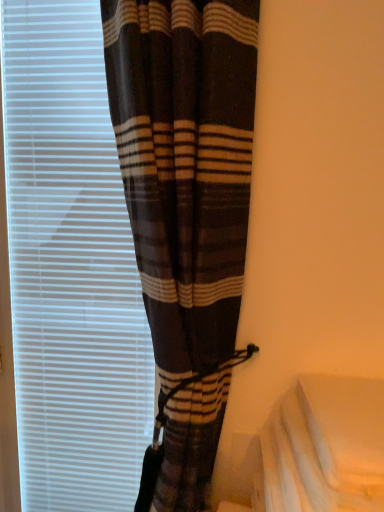
Question: From a real-world perspective, does white matte window blind at left sit lower than white fabric at lower right?

Choices:
 (A) no
 (B) yes

Answer: (A)

Question: Is white matte window blind at left oriented towards white fabric at lower right?

Choices:
 (A) yes
 (B) no

Answer: (B)

Question: Considering the relative sizes of white matte window blind at left and white fabric at lower right in the image provided, is white matte window blind at left thinner than white fabric at lower right?

Choices:
 (A) yes
 (B) no

Answer: (A)

Question: Can we say white matte window blind at left lies outside white fabric at lower right?

Choices:
 (A) yes
 (B) no

Answer: (A)

Question: Is white matte window blind at left looking in the opposite direction of white fabric at lower right?

Choices:
 (A) yes
 (B) no

Answer: (B)

Question: Is white matte window blind at left further to camera compared to white fabric at lower right?

Choices:
 (A) yes
 (B) no

Answer: (A)

Question: From the image's perspective, is brown plaid curtain at left on top of white fabric at lower right?

Choices:
 (A) no
 (B) yes

Answer: (B)

Question: Does brown plaid curtain at left have a greater width compared to white fabric at lower right?

Choices:
 (A) yes
 (B) no

Answer: (B)

Question: Is brown plaid curtain at left closer to camera compared to white fabric at lower right?

Choices:
 (A) no
 (B) yes

Answer: (B)

Question: Considering the relative sizes of brown plaid curtain at left and white fabric at lower right in the image provided, is brown plaid curtain at left taller than white fabric at lower right?

Choices:
 (A) no
 (B) yes

Answer: (B)

Question: Considering the relative sizes of brown plaid curtain at left and white fabric at lower right in the image provided, is brown plaid curtain at left thinner than white fabric at lower right?

Choices:
 (A) no
 (B) yes

Answer: (B)

Question: From a real-world perspective, is brown plaid curtain at left on white fabric at lower right?

Choices:
 (A) yes
 (B) no

Answer: (A)

Question: Does brown plaid curtain at left have a lesser width compared to white matte window blind at left?

Choices:
 (A) yes
 (B) no

Answer: (B)